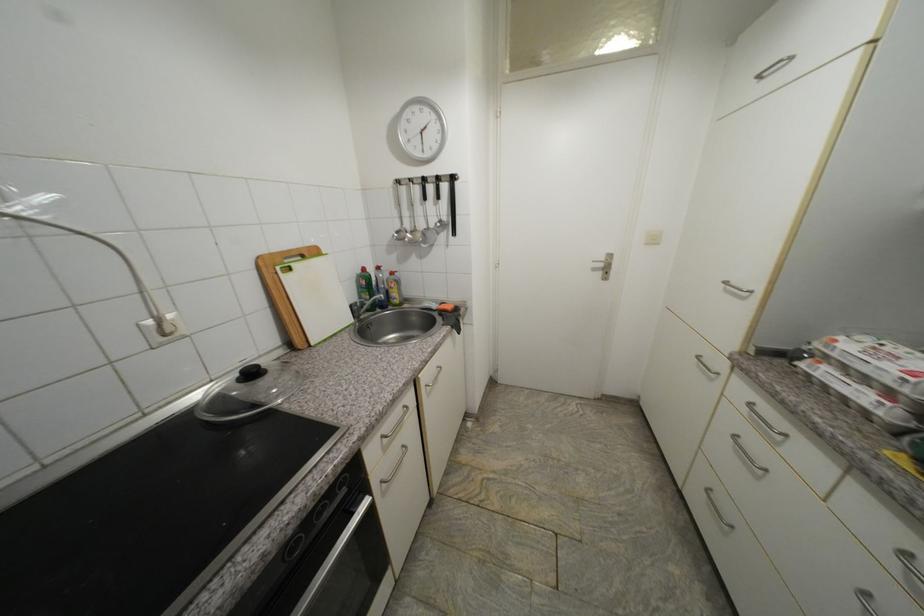
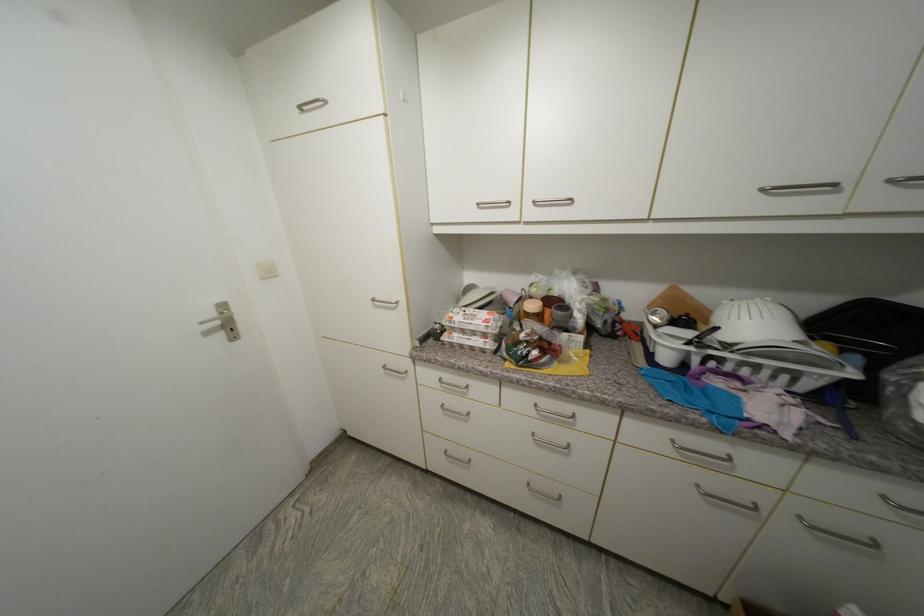
Find the pixel in the second image that matches [732,284] in the first image.

(379, 301)